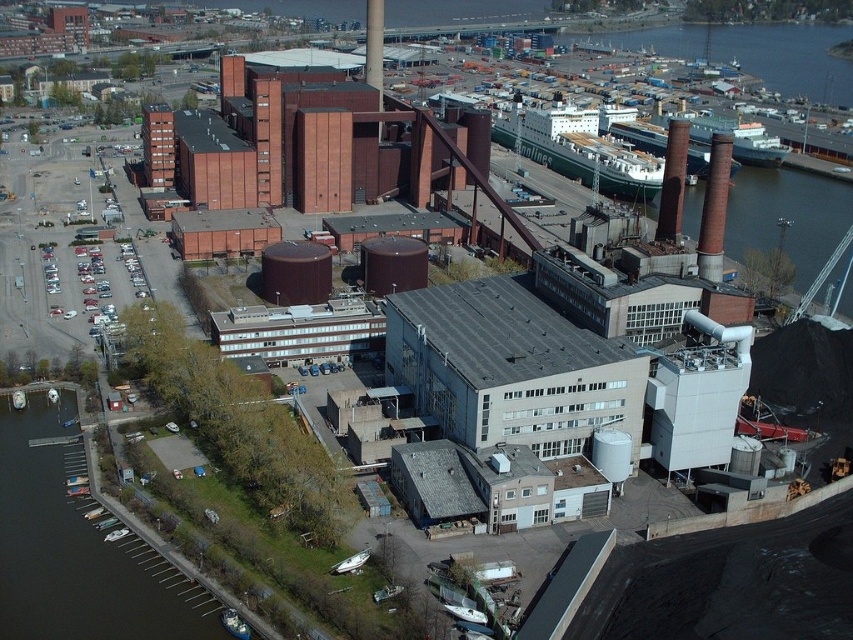
Does dark green water at lower left come behind rustic brick chimney at upper right?

No, it is in front of rustic brick chimney at upper right.

Which is behind, point (4, 470) or point (712, 275)?

Positioned behind is point (712, 275).

Is point (199, 593) closer to viewer compared to point (718, 248)?

Yes.

In order to click on dark green water at lower left in this screenshot , I will do `click(77, 548)`.

Who is more forward, (x=706, y=180) or (x=672, y=196)?

Point (x=672, y=196) is in front.

Locate an element on the screen. The width and height of the screenshot is (853, 640). rustic brick chimney at upper right is located at coordinates click(x=714, y=209).

I want to click on rustic brick chimney at upper right, so click(x=714, y=209).

Is dark green water at lower left further to camera compared to smooth brick chimney at upper right?

No.

Which of these two, dark green water at lower left or smooth brick chimney at upper right, stands taller?

smooth brick chimney at upper right is taller.

Who is more forward, (146, 604) or (670, 212)?

Point (146, 604) is in front.

Image resolution: width=853 pixels, height=640 pixels. I want to click on dark green water at lower left, so click(x=77, y=548).